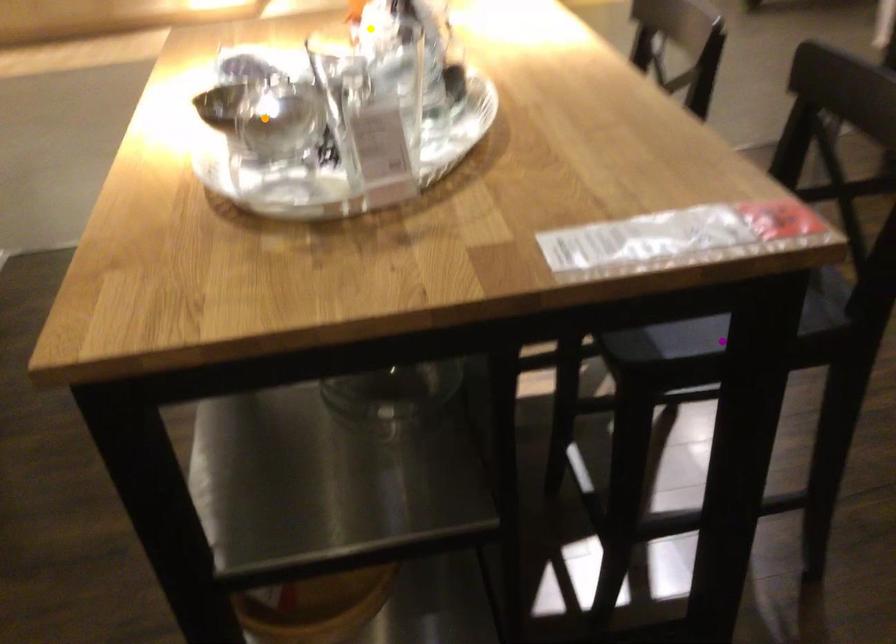
Order these from nearest to farthest:
purple point, yellow point, orange point

1. orange point
2. purple point
3. yellow point